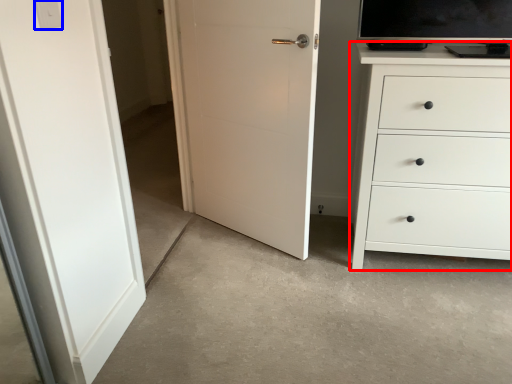
Question: Which object appears closest to the camera in this image, chest of drawers (highlighted by a red box) or light switch (highlighted by a blue box)?

Choices:
 (A) chest of drawers
 (B) light switch

Answer: (B)